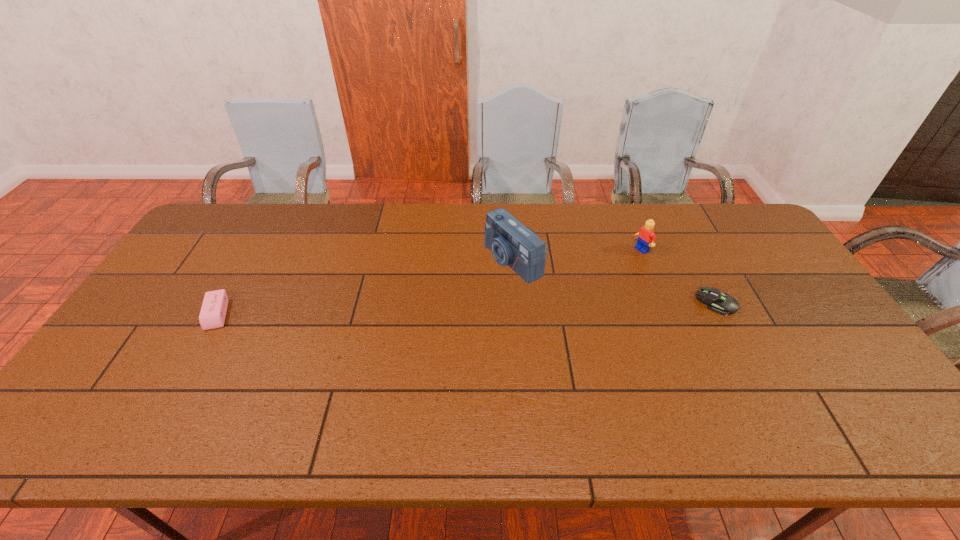
The height and width of the screenshot is (540, 960). Identify the location of free space at the far left corner of the desktop. (232, 247).

What are the coordinates of `free spot at the near left corner of the desktop` in the screenshot? It's located at tap(104, 387).

Identify the location of empty location between the shortest object and the second object from right to left. (679, 276).

I want to click on vacant point located between the eraser and the third shortest object, so click(429, 281).

Where is `unoccupied position between the second object from right to left and the eraser`? unoccupied position between the second object from right to left and the eraser is located at coordinates tap(429, 281).

This screenshot has height=540, width=960. Identify the location of vacant area that lies between the Lego and the third object from right to left. (577, 255).

Where is `unoccupied area between the rightmost object and the second object from left to right`? The image size is (960, 540). unoccupied area between the rightmost object and the second object from left to right is located at coordinates (614, 282).

Where is `vacant space that is in between the camera and the second shortest object`? vacant space that is in between the camera and the second shortest object is located at coordinates (x=365, y=287).

You are a GUI agent. You are given a task and a screenshot of the screen. Output one action in this format:
    pyautogui.click(x=<x>, y=<y>)
    Task: Click on the free point between the shortest object and the second object from right to left
    This screenshot has height=540, width=960.
    Given the screenshot: What is the action you would take?
    pyautogui.click(x=679, y=276)

Find the location of a particular element. Image resolution: width=960 pixels, height=540 pixels. unoccupied position between the second object from right to left and the camera is located at coordinates (577, 255).